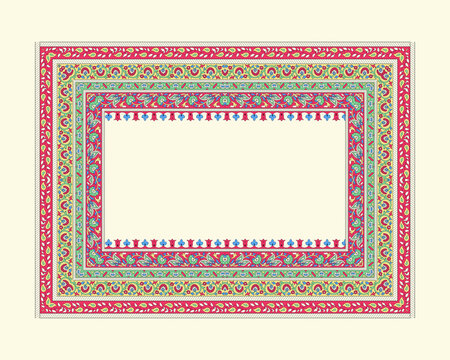
Where is `top left corner of rug`? The image size is (450, 360). top left corner of rug is located at coordinates (36, 45).